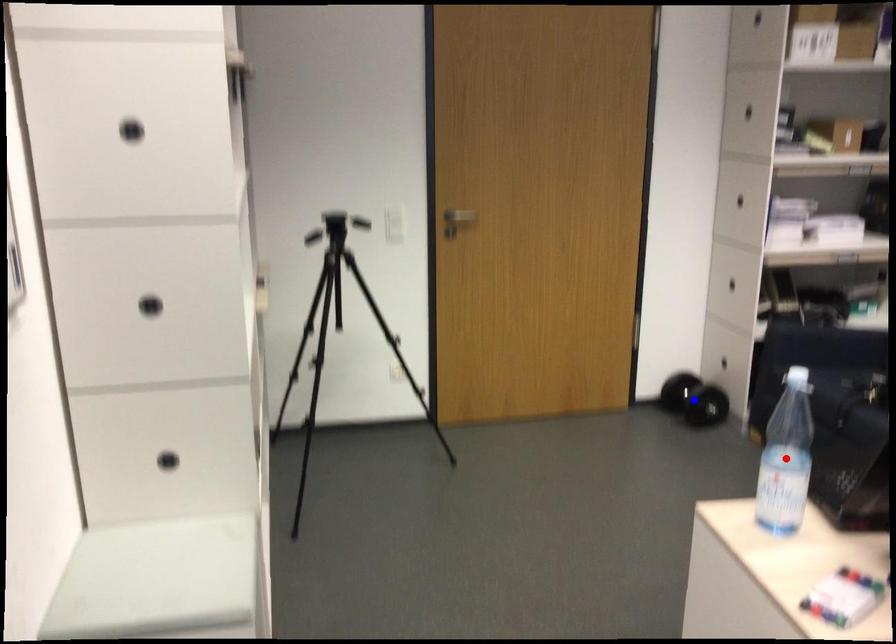
Question: Two points are marked on the image. Which point is closer to the camera?

Choices:
 (A) Blue point is closer.
 (B) Red point is closer.

Answer: (B)